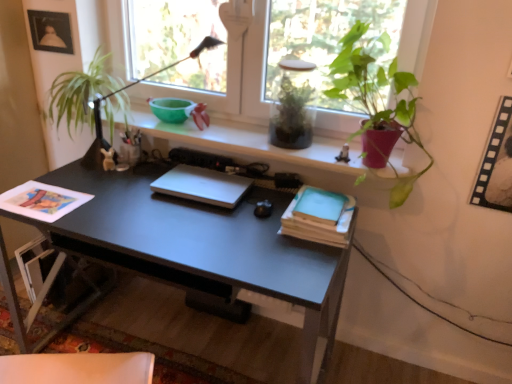
At what (x,y) coordinates should I click in order to perform the action: click on vacant region under light blue matte paper at center right, the second paperback book when ordered from bottom to top (from a real-world perspective). Please return your answer as a coordinate pair (x, y). The width and height of the screenshot is (512, 384). Looking at the image, I should click on (317, 211).